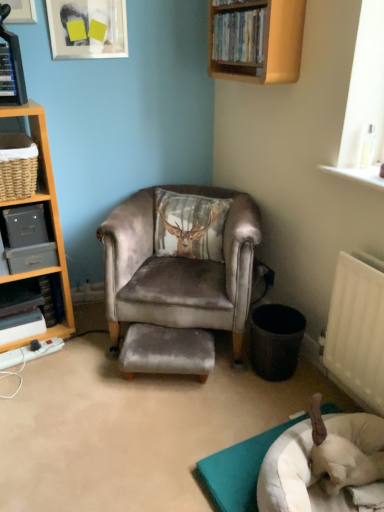
This screenshot has width=384, height=512. I want to click on vacant space in front of black plastic trash can at lower right, so click(277, 399).